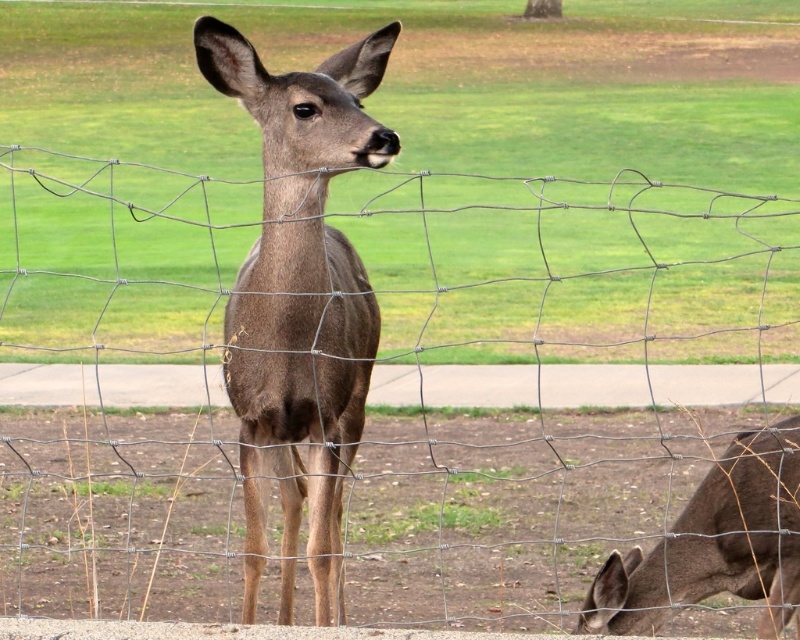
Where is the brown matte roe deer at center located in the image?

The brown matte roe deer at center is located at point (300, 300) in the image.